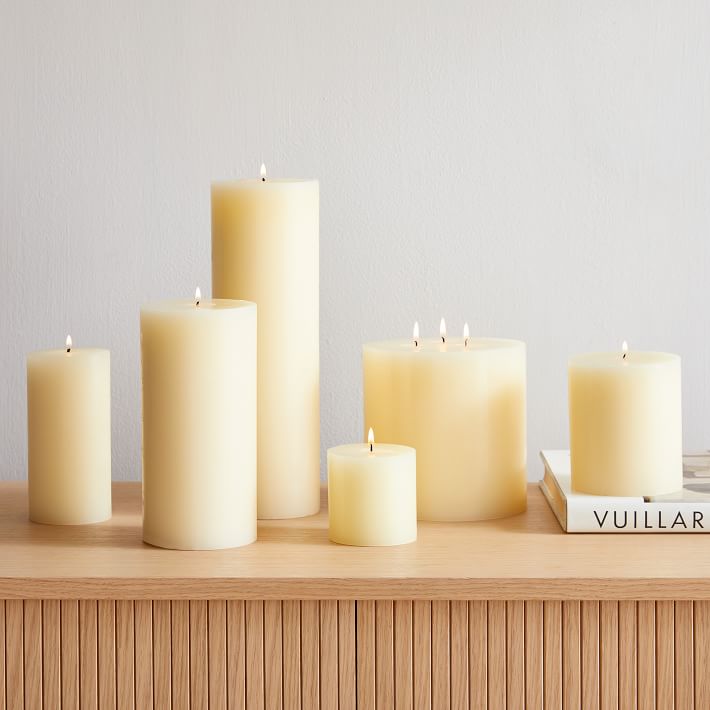
Identify the location of candle wicks. The image size is (710, 710). (65, 349), (195, 302), (263, 173), (415, 338), (439, 338), (464, 337), (626, 353), (371, 447).